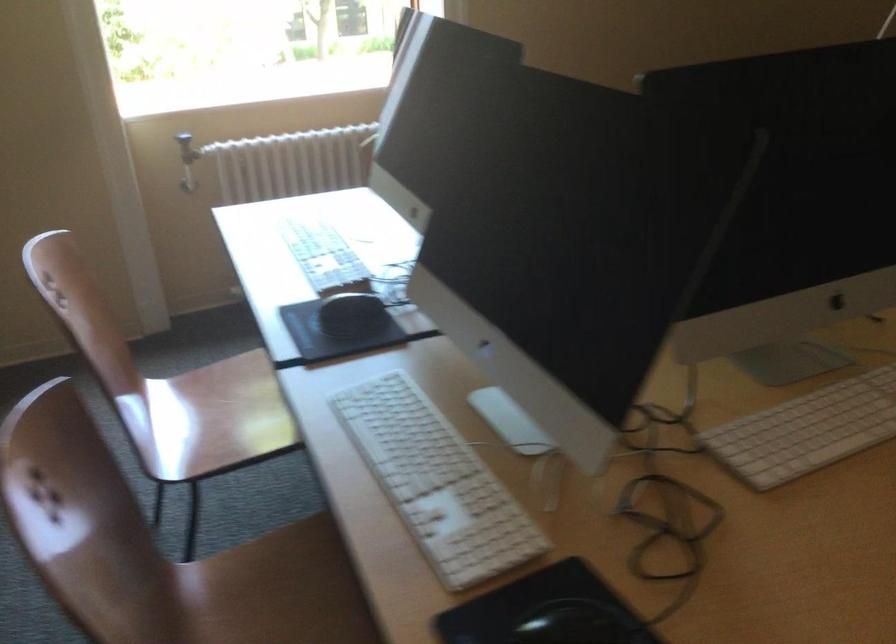
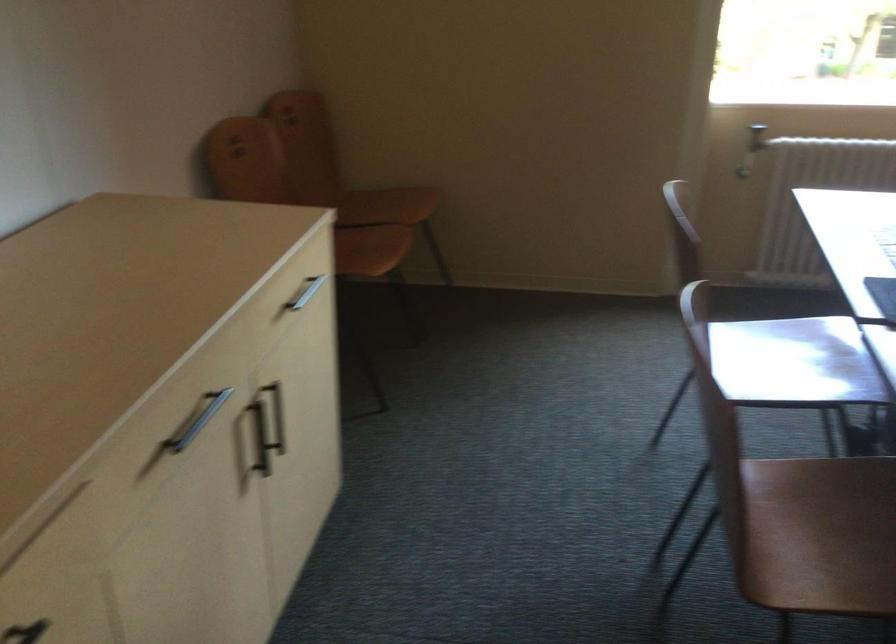
Locate, in the second image, the point that corresponds to (202,196) in the first image.

(743, 172)